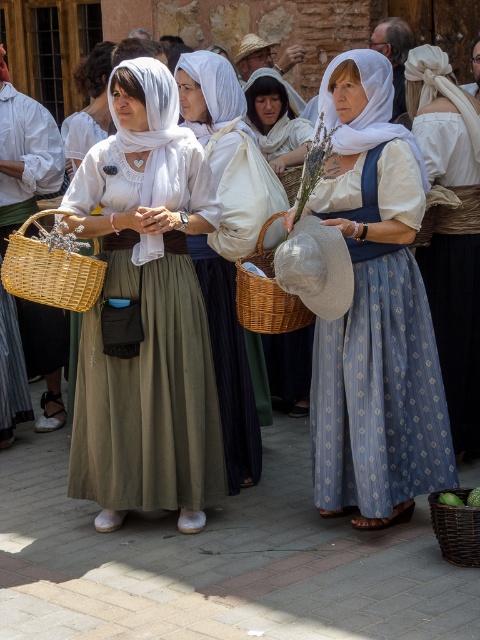
You are organizing a cultural event and need to decide which item to use for a headpiece. Both the matte white scarf at center and the matte white cloth at center are available. Which one is smaller and more suitable for a headpiece?

The matte white scarf at center is smaller than the matte white cloth at center, making it more suitable for a headpiece.

You are a photographer at the event and want to ensure both the blue printed dress at center and the matte white cloth at center are visible in your photo. Given their sizes, which one might you need to adjust your camera angle to include fully?

The blue printed dress at center is taller than the matte white cloth at center, so you might need to adjust your camera angle to include the taller blue printed dress at center fully.

You are organizing a traditional dance performance and need to ensure the dancers have enough fabric for their movements. The dancers are wearing the matte white scarf at center and the matte white cloth at center. Which item would allow for more flowing movements due to its size?

The matte white cloth at center allows for more flowing movements because it is wider than the matte white scarf at center.